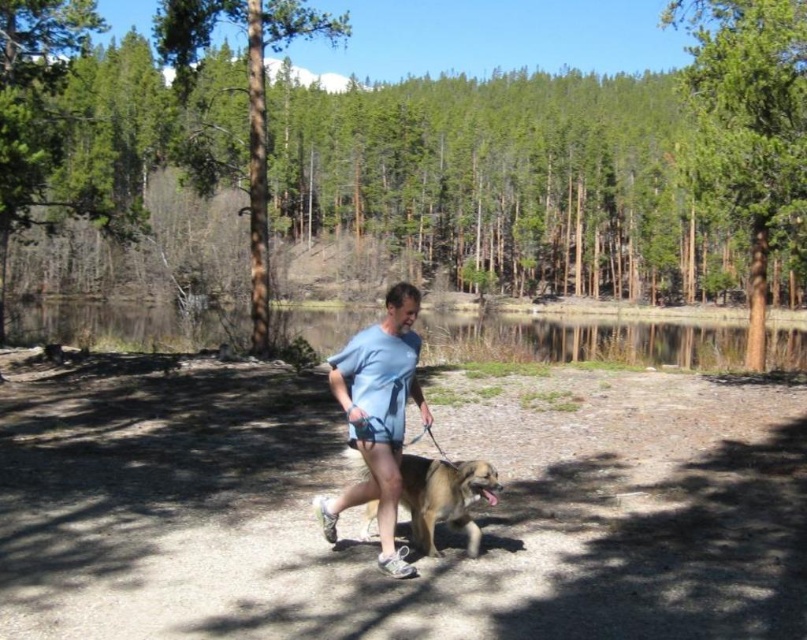
Measure the distance between green textured tree at upper center and brown fur dog at center.

The distance of green textured tree at upper center from brown fur dog at center is 56.16 feet.

Does green textured tree at upper center have a greater width compared to brown fur dog at center?

Yes, green textured tree at upper center is wider than brown fur dog at center.

What do you see at coordinates (247, 96) in the screenshot? This screenshot has width=807, height=640. I see `green textured tree at upper center` at bounding box center [247, 96].

Locate an element on the screen. The height and width of the screenshot is (640, 807). green textured tree at upper center is located at coordinates (247, 96).

Does clear water at center have a greater width compared to light blue fabric at center?

Indeed, clear water at center has a greater width compared to light blue fabric at center.

Which is more to the left, clear water at center or light blue fabric at center?

light blue fabric at center is more to the left.

Between point (282, 321) and point (341, 506), which one is positioned behind?

The point (282, 321) is behind.

You are a GUI agent. You are given a task and a screenshot of the screen. Output one action in this format:
    pyautogui.click(x=<x>, y=<y>)
    Task: Click on the clear water at center
    
    Given the screenshot: What is the action you would take?
    pyautogui.click(x=582, y=340)

Which is below, light blue fabric at center or green textured tree at upper center?

light blue fabric at center is lower down.

Does point (395, 333) lie behind point (258, 150)?

No, it is not.

Find the location of a particular element. light blue fabric at center is located at coordinates (377, 417).